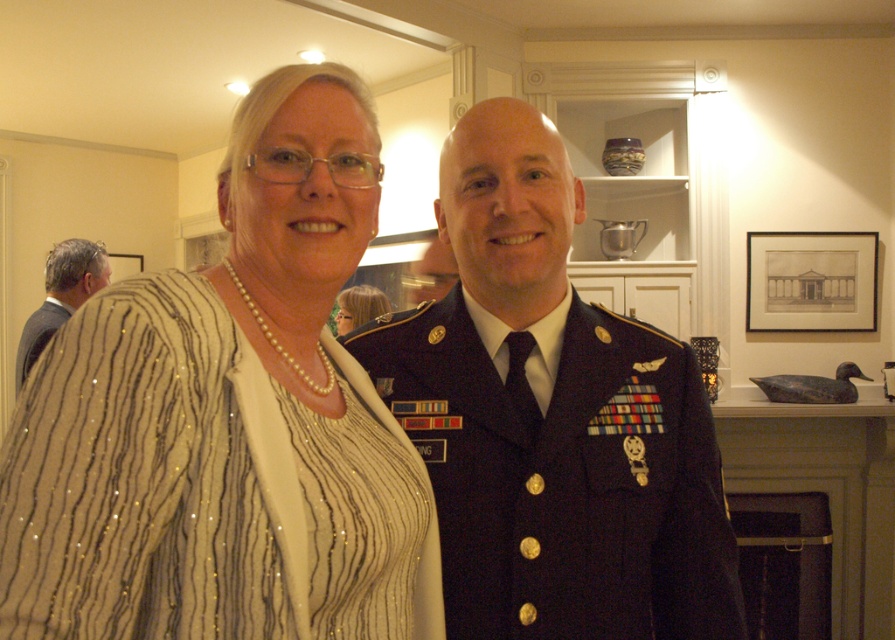
Who is shorter, navy blue uniform at center or black matte picture frame at upper center?

Standing shorter between the two is black matte picture frame at upper center.

Between point (627, 541) and point (787, 285), which one is positioned in front?

Positioned in front is point (627, 541).

Who is more distant from viewer, (458,458) or (788,244)?

The point (788,244) is behind.

Identify the location of navy blue uniform at center. [551, 417].

Is navy blue uniform at center further to camera compared to dark suit at left?

No, it is in front of dark suit at left.

Identify the location of navy blue uniform at center. Image resolution: width=895 pixels, height=640 pixels. (551, 417).

Between point (48, 288) and point (58, 320), which one is positioned behind?

The point (48, 288) is behind.

Does dark suit at left appear under satin black uniform at center?

No, dark suit at left is not below satin black uniform at center.

Between point (78, 273) and point (28, 336), which one is positioned behind?

Point (78, 273)

Identify the location of dark suit at left. This screenshot has width=895, height=640. (x=61, y=296).